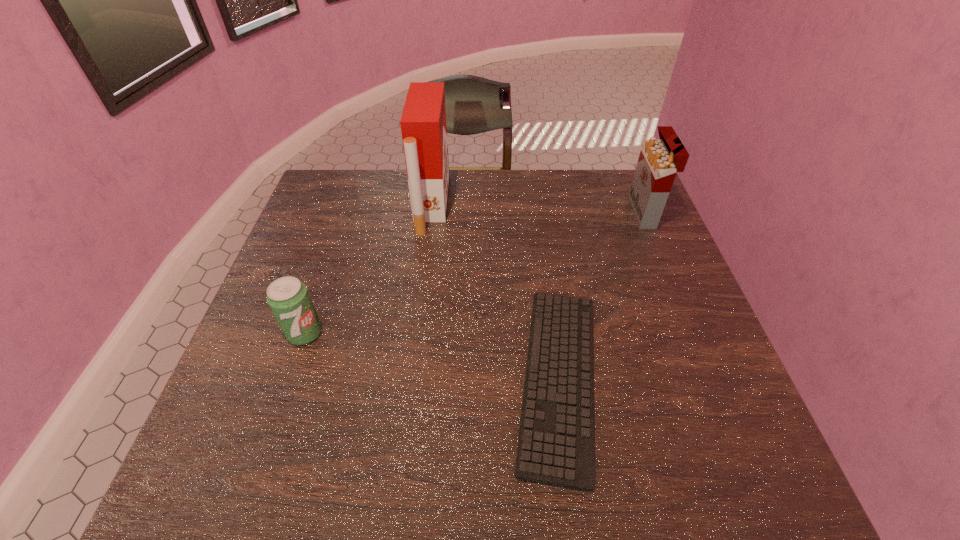
This screenshot has width=960, height=540. Find the location of `vacant space that satisfies the following two spatial constraints: 1. on the front-facing side of the second object from left to right; 2. on the front side of the third tallest object`. vacant space that satisfies the following two spatial constraints: 1. on the front-facing side of the second object from left to right; 2. on the front side of the third tallest object is located at coordinates (416, 333).

Find the location of a particular element. Image resolution: width=960 pixels, height=540 pixels. free spot that satisfies the following two spatial constraints: 1. on the front-facing side of the left cigarette case; 2. on the left side of the computer keyboard is located at coordinates (410, 379).

Find the location of a particular element. This screenshot has width=960, height=540. vacant point that satisfies the following two spatial constraints: 1. on the front-facing side of the left cigarette case; 2. on the right side of the third object from left to right is located at coordinates (410, 379).

In order to click on free space that satisfies the following two spatial constraints: 1. on the front-facing side of the third object from right to left; 2. on the back side of the computer keyboard in this screenshot , I will do `click(410, 379)`.

Locate an element on the screen. vacant space that satisfies the following two spatial constraints: 1. on the front-facing side of the left cigarette case; 2. on the front side of the leftmost object is located at coordinates (416, 333).